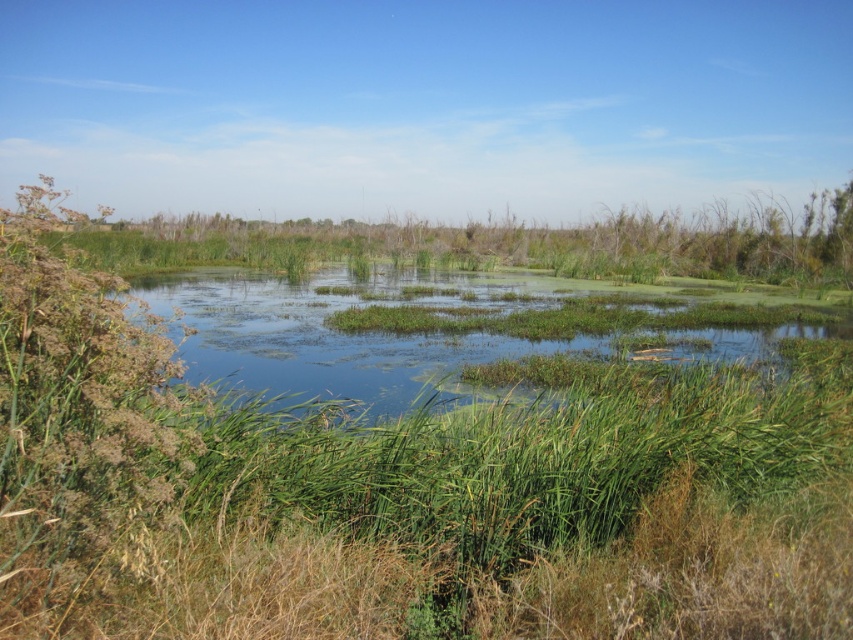
You are a bird flying over the wetland scene. You see the green grassy wetland at center and the green grassy lake at center. Which one is located to the left side of the other?

The green grassy wetland at center is to the left of green grassy lake at center.

You are a bird flying over the wetland scene. You need to land on the smaller area between the green grassy wetland at center and the green grassy lake at center. Which area should you choose?

You should land on the green grassy wetland at center because it is smaller than the green grassy lake at center, as stated in the description.

You are standing at the edge of the wetland and want to cross to the other side. The green grassy wetland at center is in your way. Can you walk directly through it?

The green grassy wetland at center is 3.27 meters away from the viewer. Since the distance is manageable, you can walk directly through it to reach the other side.